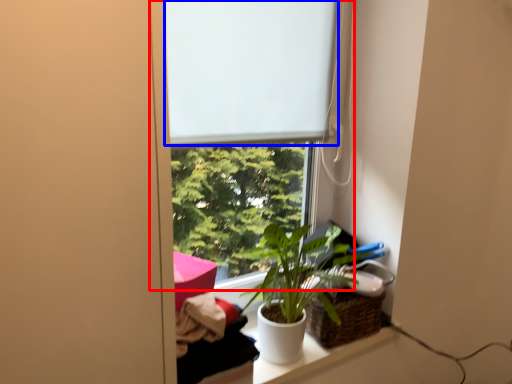
Question: Which point is further to the camera, window (highlighted by a red box) or window screen (highlighted by a blue box)?

Choices:
 (A) window
 (B) window screen

Answer: (B)